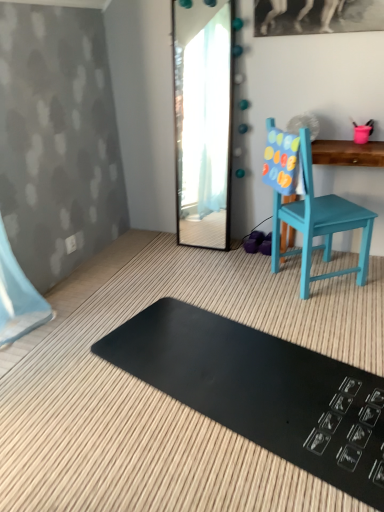
Locate an element on the screen. empty space that is ontop of teal painted wood changing table at right (from a real-world perspective) is located at coordinates (334, 141).